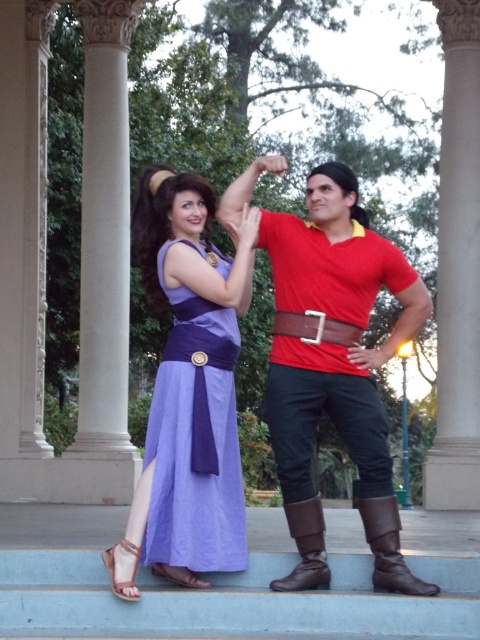
You are a costume designer preparing for a play. You have two brown leather boots in the scene. One is labeled as brown leather boot at lower right and the other as brown leather boot at lower center. Which boot has a greater width?

The brown leather boot at lower right has a greater width than the brown leather boot at lower center according to the description.

You are a costume designer preparing for a play. You need to ensure that the matte red shirt at center and the brown leather boot at lower center are visible to the audience. Based on their positions, which costume element should be placed higher on the stage to ensure visibility?

The matte red shirt at center should be placed higher on the stage because it is already taller than the brown leather boot at lower center, so positioning it higher will maintain its visibility over the boot.

You are a photographer standing between the two people in the image. You want to take a photo of both of them in the same frame. Given that your camera has a maximum zoom range of 10 meters, will you be able to capture both the purple satin dress at center and the other person in the frame without moving closer?

The two individuals are 18.06 meters apart, which exceeds the camera maximum zoom range of 10 meters. Therefore, you cannot capture both the purple satin dress at center and the other person in the same frame without moving closer.